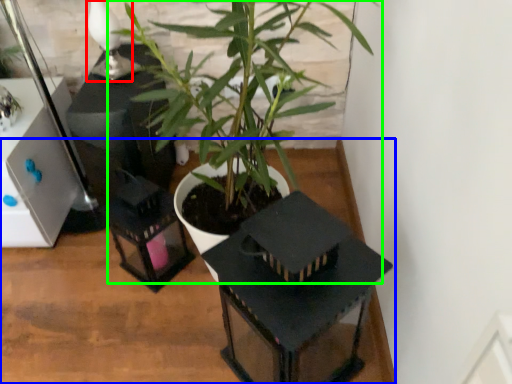
Question: Estimate the real-world distances between objects in this image. Which object is farther from table lamp (highlighted by a red box), table (highlighted by a blue box) or houseplant (highlighted by a green box)?

Choices:
 (A) table
 (B) houseplant

Answer: (A)